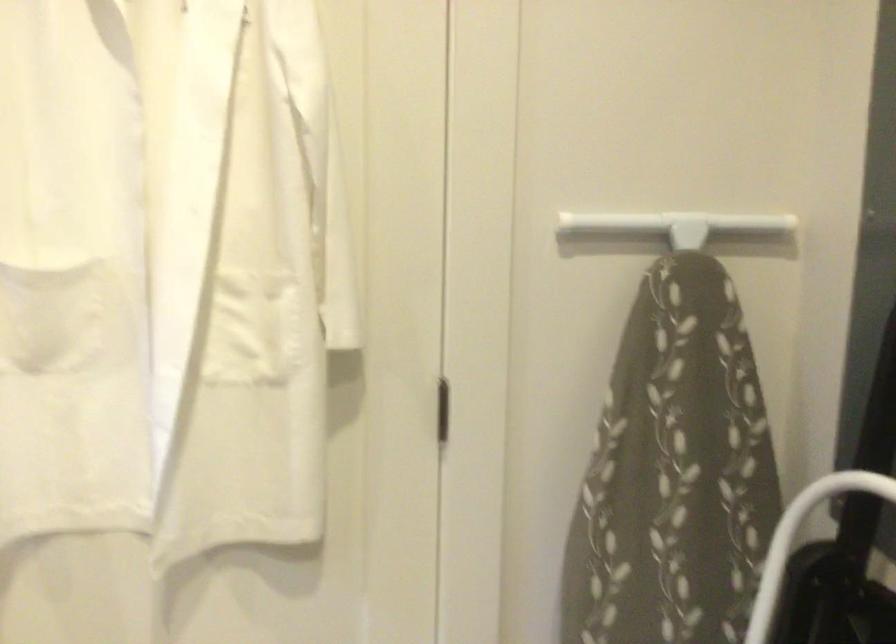
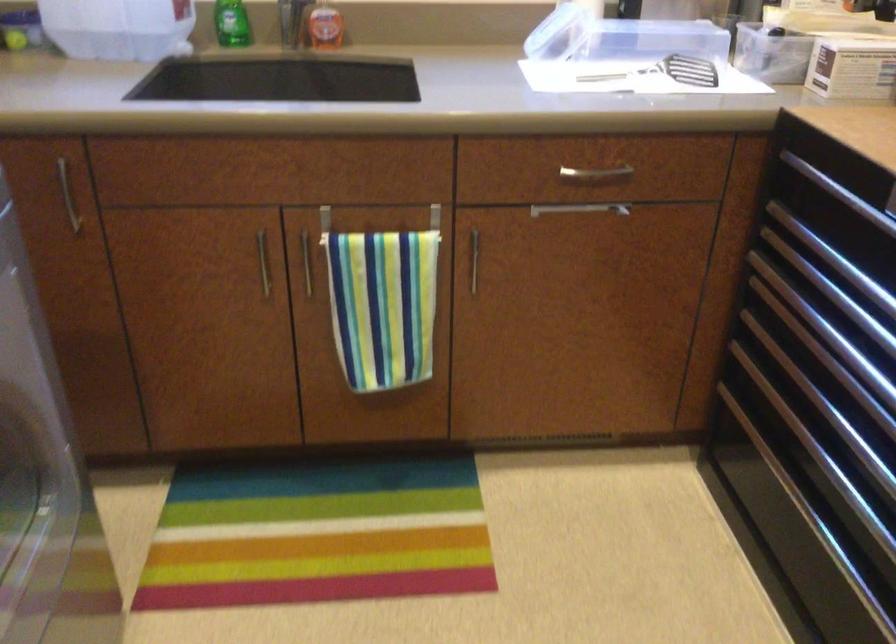
The images are taken continuously from a first-person perspective. In which direction is your viewpoint rotating?

The rotation direction of the camera is left-down.